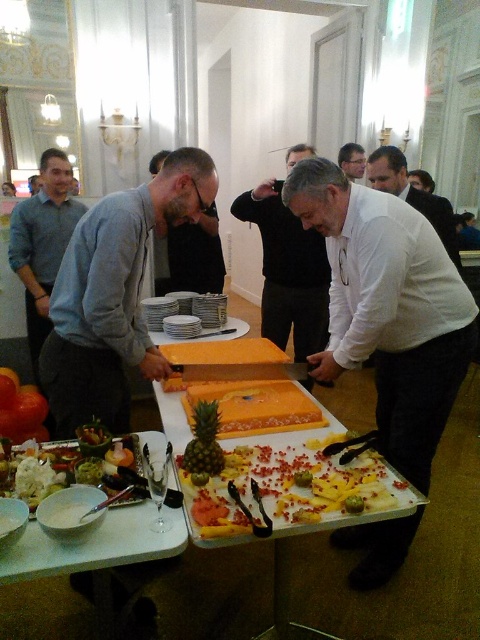
You are a photographer at the event and need to capture a clear photo of the cake. The two people in black matte sweater at center and smooth black shirt at center are blocking the view. Which one should you ask to move so that the lower one can step aside?

The black matte sweater at center is below smooth black shirt at center, so you should ask the black matte sweater at center to move since it is lower and closer to the cake.